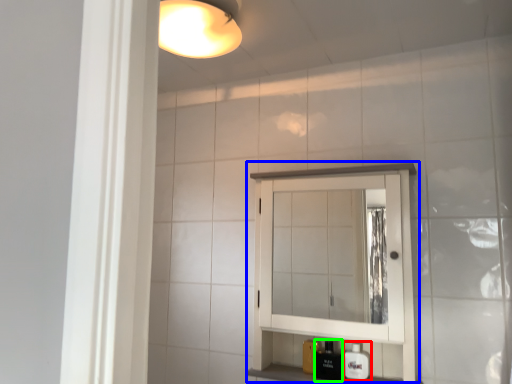
Question: Which object is positioned farthest from soap dispenser (highlighted by a red box)? Select from medicine cabinet (highlighted by a blue box) and toiletry (highlighted by a green box).

Choices:
 (A) medicine cabinet
 (B) toiletry

Answer: (A)